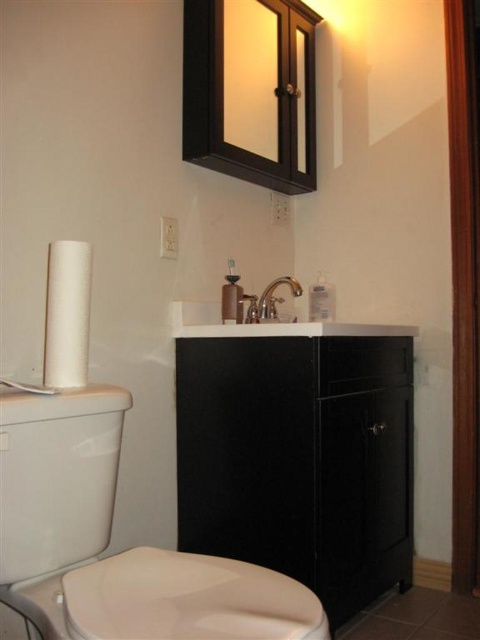
Is white matte toilet paper at left above white glossy sink at center?

No.

Which is in front, point (83, 276) or point (284, 321)?

Positioned in front is point (83, 276).

Identify the location of white matte toilet paper at left. (67, 314).

Which is above, white matte toilet paper at left or satin nickel faucet at center?

satin nickel faucet at center

Between point (69, 256) and point (261, 298), which one is positioned behind?

Point (261, 298)

Consider the image. Who is more distant from viewer, (79, 314) or (251, 312)?

The point (251, 312) is behind.

In order to click on white matte toilet paper at left in this screenshot , I will do `click(67, 314)`.

Is point (48, 280) in front of point (300, 294)?

Yes.

Who is higher up, white matte toilet paper at left or silver metallic faucet at center?

silver metallic faucet at center is above.

Between point (71, 301) and point (295, 296), which one is positioned behind?

The point (295, 296) is behind.

Locate an element on the screen. The image size is (480, 640). white matte toilet paper at left is located at coordinates (67, 314).